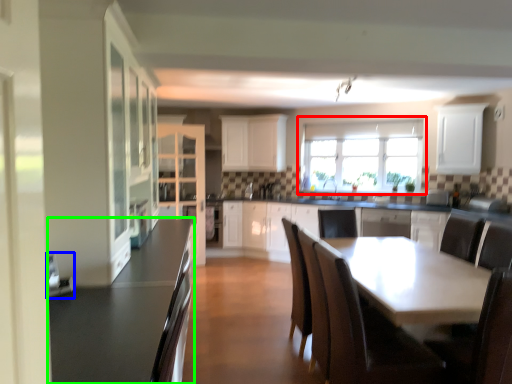
Question: Which object is the farthest from window (highlighted by a red box)? Choose among these: appliance (highlighted by a blue box) or countertop (highlighted by a green box).

Choices:
 (A) appliance
 (B) countertop

Answer: (A)